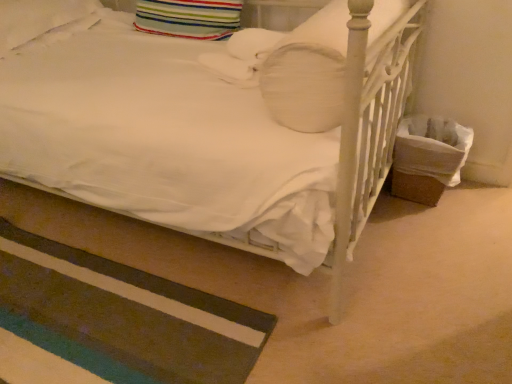
Where is `vacant point to the right of striped carpet at lower left`? vacant point to the right of striped carpet at lower left is located at coordinates (304, 294).